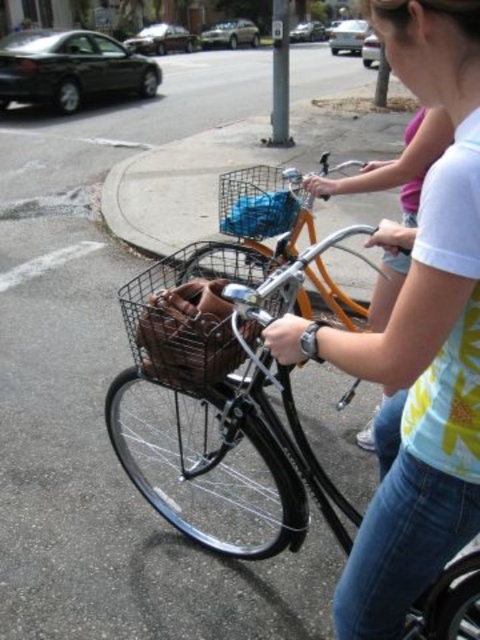
Can you confirm if white cotton shirt at upper right is shorter than woven brown basket at center?

In fact, white cotton shirt at upper right may be taller than woven brown basket at center.

Is point (456, 445) in front of point (214, 355)?

Yes, it is in front of point (214, 355).

In order to click on white cotton shirt at upper right in this screenshot , I will do `click(418, 340)`.

Consider the image. Does white cotton shirt at upper right have a lesser height compared to wire mesh basket at center?

In fact, white cotton shirt at upper right may be taller than wire mesh basket at center.

Who is more distant from viewer, (392, 612) or (255, 180)?

The point (255, 180) is more distant.

Locate an element on the screen. The width and height of the screenshot is (480, 640). white cotton shirt at upper right is located at coordinates (418, 340).

Does woven brown basket at center appear on the left side of white cotton shirt at center?

Yes, woven brown basket at center is to the left of white cotton shirt at center.

Can you confirm if woven brown basket at center is positioned above white cotton shirt at center?

No.

Is point (180, 317) positioned before point (360, 429)?

Yes, it is in front of point (360, 429).

Find the location of `woven brown basket at center`. woven brown basket at center is located at coordinates (186, 317).